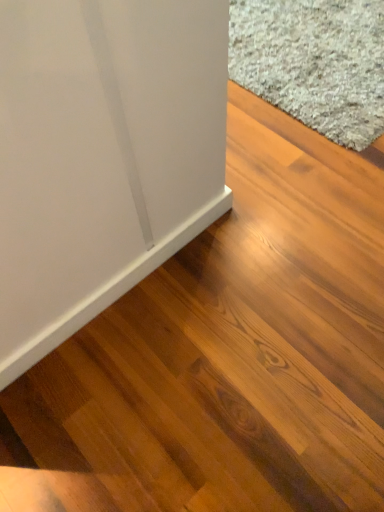
Locate an element on the screen. The height and width of the screenshot is (512, 384). free point to the right of white matte baseboard at lower left is located at coordinates (262, 274).